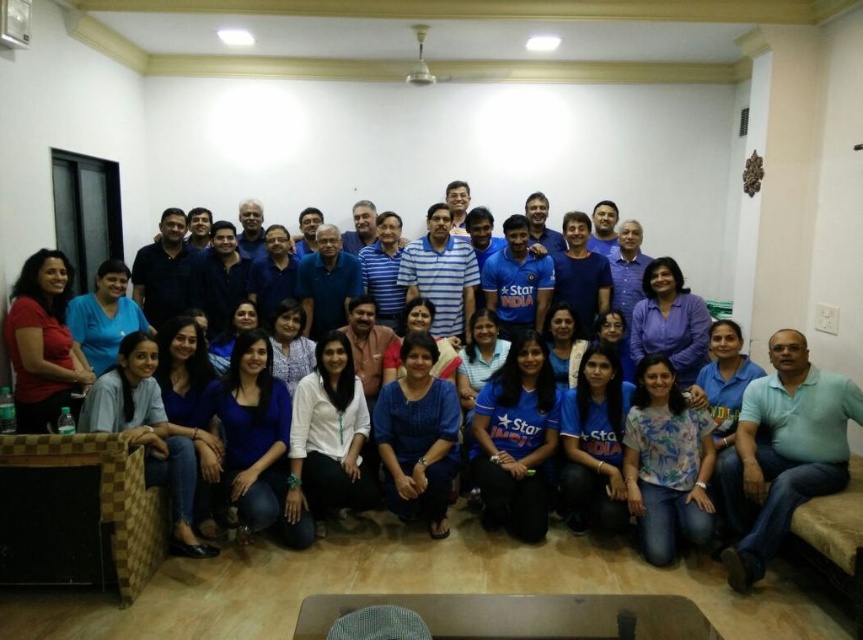
Question: Can you confirm if light blue cotton shirt at lower right is smaller than matte red shirt at lower left?

Choices:
 (A) no
 (B) yes

Answer: (A)

Question: In this image, where is light blue cotton shirt at lower right located relative to matte red shirt at lower left?

Choices:
 (A) left
 (B) right

Answer: (B)

Question: Is light blue cotton shirt at lower right positioned at the back of matte red shirt at lower left?

Choices:
 (A) no
 (B) yes

Answer: (A)

Question: Among these objects, which one is nearest to the camera?

Choices:
 (A) matte red shirt at lower left
 (B) light blue cotton shirt at lower right

Answer: (B)